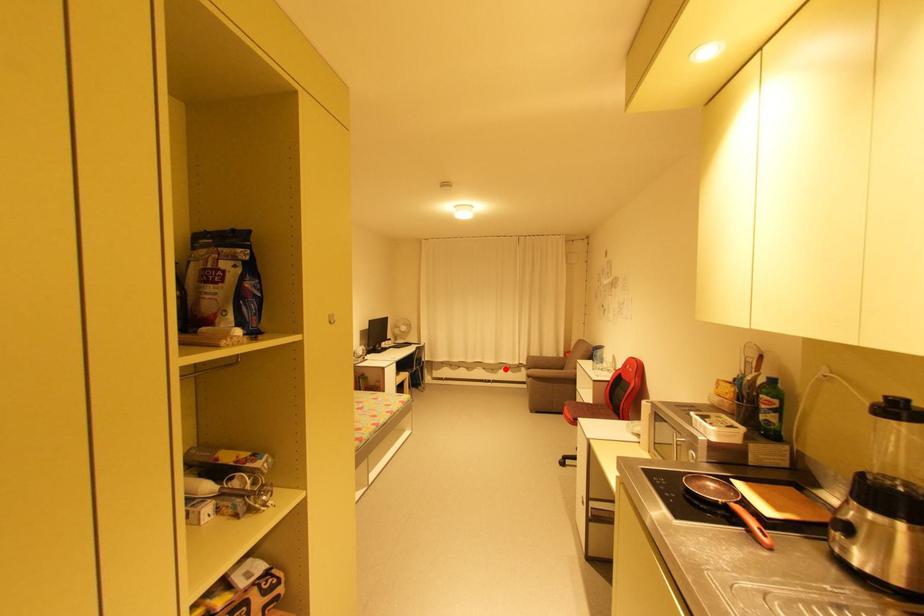
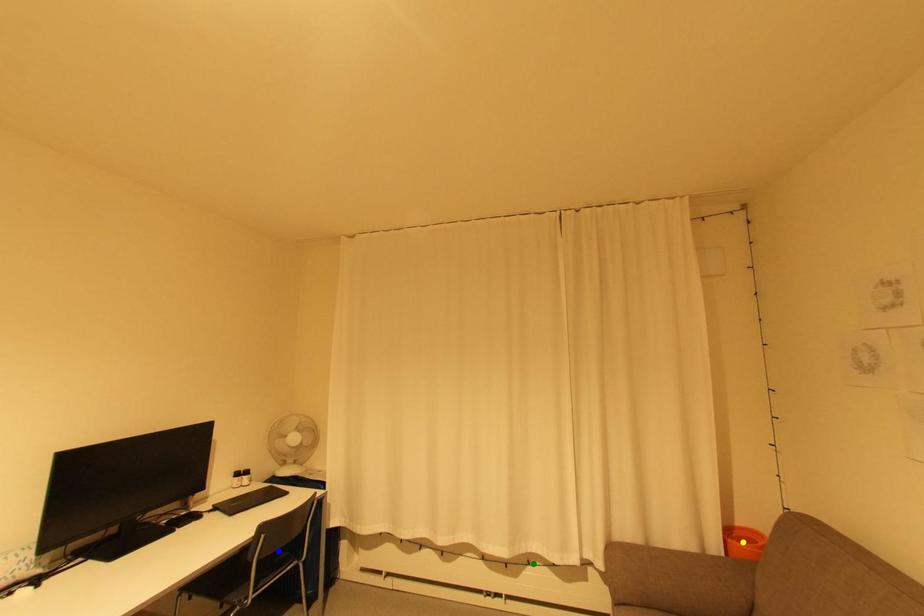
Question: I am providing you with two images of the same scene from different viewpoints. A red point is marked on the first image. You are given multiple points on the second image. Which point in image 2 represents the same 3d spot as the red point in image 1?

Choices:
 (A) blue point
 (B) green point
 (C) yellow point

Answer: (B)